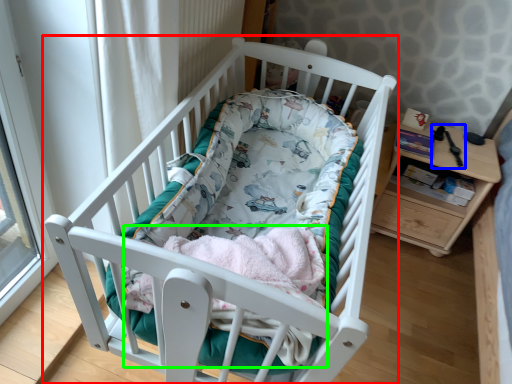
Question: Estimate the real-world distances between objects in this image. Which object is farther from infant bed (highlighted by a red box), equipment (highlighted by a blue box) or baby clothe (highlighted by a green box)?

Choices:
 (A) equipment
 (B) baby clothe

Answer: (A)